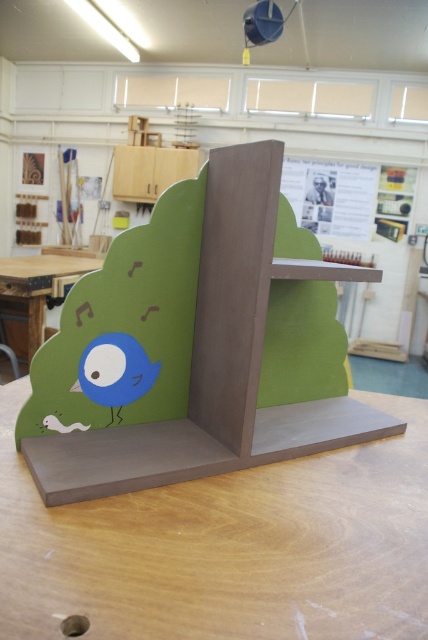
Consider the image. You are organizing a small toy collection on a table. You have a matte blue bird at lower left and a matte wood table at lower left. Which object is positioned lower on the table?

The matte blue bird at lower left is positioned lower on the table than the matte wood table at lower left.

You are organizing a craft fair and need to place two tables in the venue. The tables are labeled as the matte brown table at center and the matte wood table at lower left. Based on the scene, which table should be positioned on the right side of the venue?

The matte brown table at center should be positioned on the right side of the venue because it is already to the right of the matte wood table at lower left in the scene.

You are an artist who needs to place a 30 cm wide sculpture on the matte brown table at center. The matte blue bird at lower left is nearby. Will the sculpture fit on the table without overlapping the bird?

The distance between the matte brown table at center and the matte blue bird at lower left is 31.63 centimeters. Since the sculpture is 30 cm wide, it can fit on the table without overlapping the bird as there is enough space between them.